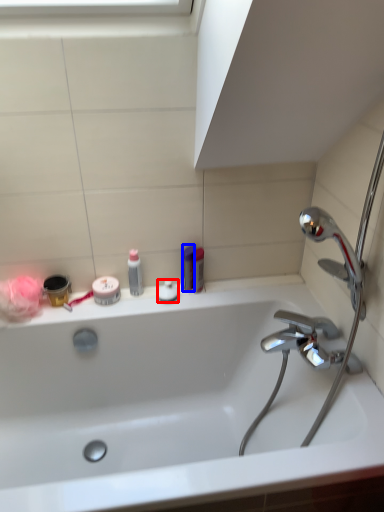
Question: Which of the following is the closest to the observer, toiletry (highlighted by a red box) or toiletry (highlighted by a blue box)?

Choices:
 (A) toiletry
 (B) toiletry

Answer: (B)